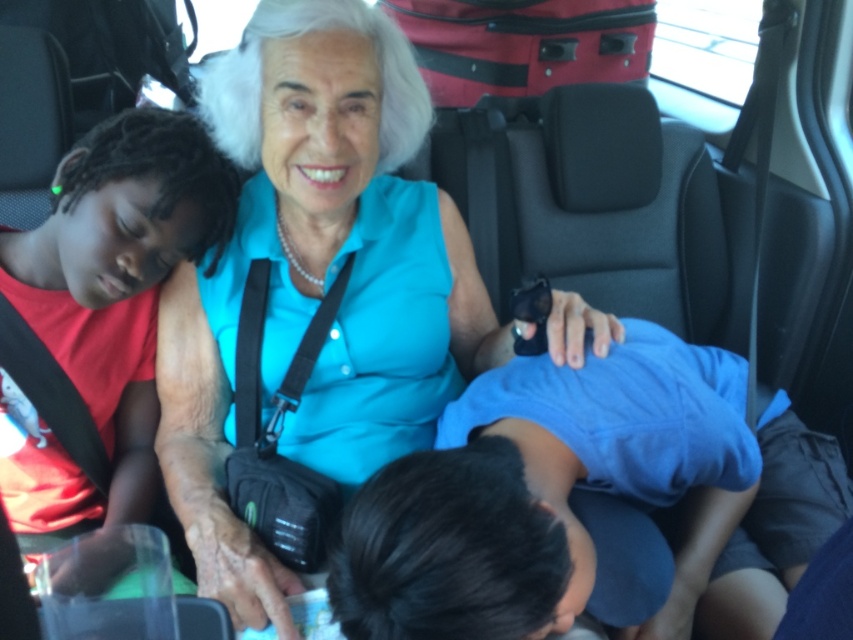
Question: Does red cotton shirt at left have a lesser width compared to red fabric suitcase at upper center?

Choices:
 (A) yes
 (B) no

Answer: (A)

Question: Observing the image, what is the correct spatial positioning of blue cotton shirt at center in reference to red fabric suitcase at upper center?

Choices:
 (A) right
 (B) left

Answer: (A)

Question: Which object is closer to the camera taking this photo?

Choices:
 (A) red cotton shirt at left
 (B) red fabric suitcase at upper center
 (C) blue cotton shirt at center

Answer: (C)

Question: Can you confirm if blue cotton shirt at center is thinner than red fabric suitcase at upper center?

Choices:
 (A) yes
 (B) no

Answer: (B)

Question: Among these points, which one is farthest from the camera?

Choices:
 (A) (138, 486)
 (B) (531, 58)
 (C) (785, 461)

Answer: (B)

Question: Which point appears closest to the camera in this image?

Choices:
 (A) (x=706, y=524)
 (B) (x=1, y=253)
 (C) (x=577, y=77)

Answer: (A)